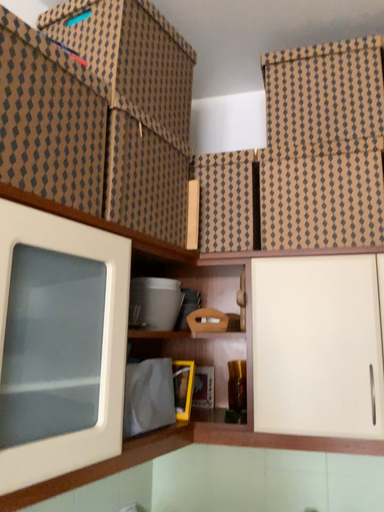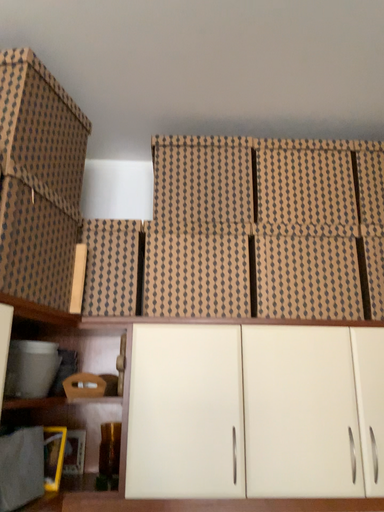
Question: How did the camera likely rotate when shooting the video?

Choices:
 (A) rotated left
 (B) rotated right

Answer: (B)